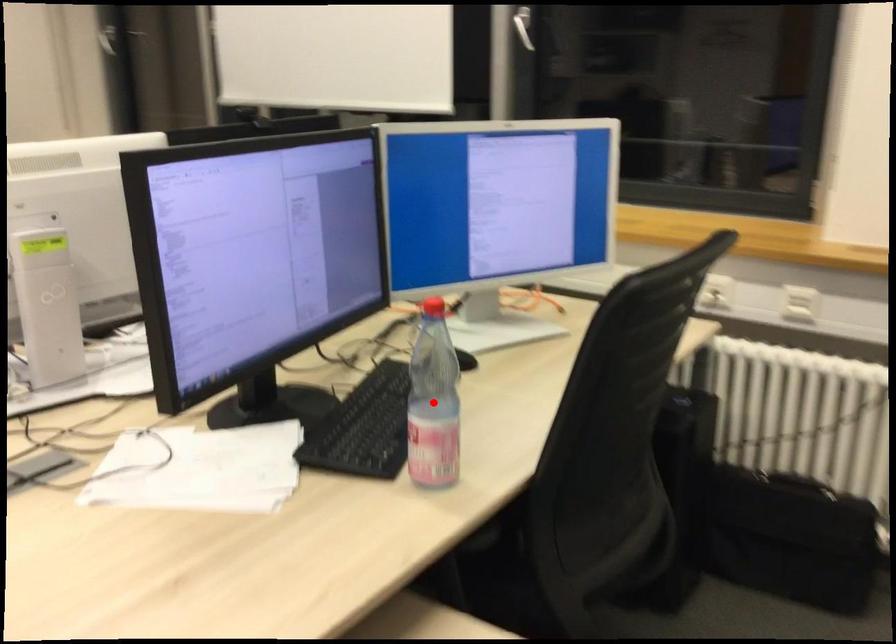
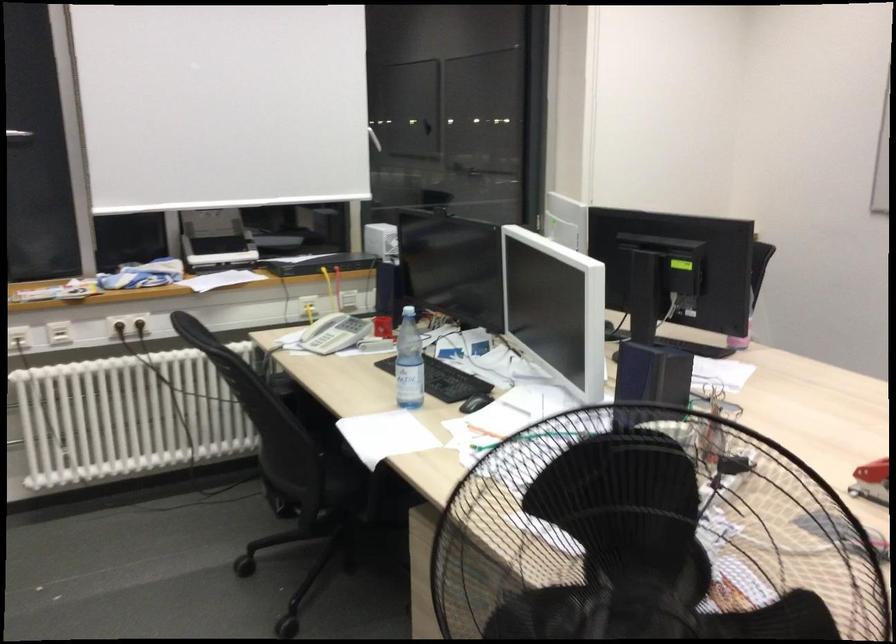
Question: I am providing you with two images of the same scene from different viewpoints. A red point is marked on the first image. Is the red point's position out of view in image 2?

Choices:
 (A) Yes
 (B) No

Answer: (A)